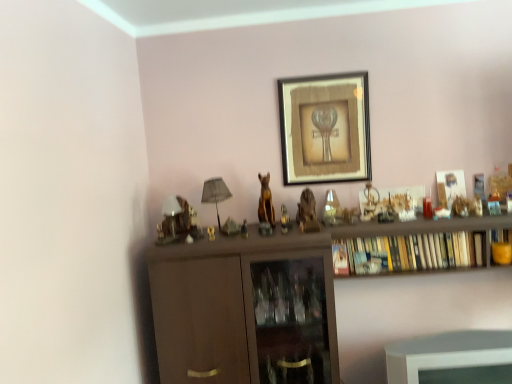
From the picture: What is the approximate width of metallic gold figurine at left, the fourth toy positioned from the right?

15.85 centimeters.

Measure the distance between point (285, 221) and camera.

6.90 feet.

How much space does metallic gold statue at center, placed as the third toy when sorted from left to right, occupy horizontally?

metallic gold statue at center, placed as the third toy when sorted from left to right, is 2.03 inches wide.

You are a GUI agent. You are given a task and a screenshot of the screen. Output one action in this format:
    pyautogui.click(x=<x>, y=<y>)
    Task: Click on the white glossy vanity at lower right
    This screenshot has height=384, width=512.
    Given the screenshot: What is the action you would take?
    pyautogui.click(x=452, y=358)

Where is `wooden statue at center, acting as the first animal starting from the right`? wooden statue at center, acting as the first animal starting from the right is located at coordinates (307, 213).

Which object is wider, matte brown statue at center, arranged as the second toy when viewed from the left, or white glossy vanity at lower right?

With larger width is white glossy vanity at lower right.

In the scene shown: Can you tell me how much matte brown statue at center, arranged as the third toy when viewed from the right, and white glossy vanity at lower right differ in facing direction?

The angular difference between matte brown statue at center, arranged as the third toy when viewed from the right, and white glossy vanity at lower right is 6.88 degrees.

Does point (244, 219) lie in front of point (396, 372)?

No, it is not.

Considering the relative positions of wooden framed artwork at center and wooden statue at center, which is the second animal in left-to-right order, in the image provided, is wooden framed artwork at center to the left of wooden statue at center, which is the second animal in left-to-right order, from the viewer's perspective?

Incorrect, wooden framed artwork at center is not on the left side of wooden statue at center, which is the second animal in left-to-right order.

Starting from the wooden framed artwork at center, which animal is the 2nd one in front? Please provide its 2D coordinates.

[(307, 213)]

Is the surface of wooden framed artwork at center in direct contact with wooden statue at center, which is the second animal in left-to-right order?

No, wooden framed artwork at center is not next to wooden statue at center, which is the second animal in left-to-right order.

In the scene shown: Considering the sizes of objects white glossy vanity at lower right and translucent glass vase at center, acting as the 4th toy starting from the left, in the image provided, who is taller, white glossy vanity at lower right or translucent glass vase at center, acting as the 4th toy starting from the left,?

With more height is white glossy vanity at lower right.

Which object is more forward, white glossy vanity at lower right or translucent glass vase at center, acting as the 4th toy starting from the left?

Positioned in front is white glossy vanity at lower right.

In terms of size, does white glossy vanity at lower right appear bigger or smaller than translucent glass vase at center, acting as the 4th toy starting from the left?

white glossy vanity at lower right is bigger than translucent glass vase at center, acting as the 4th toy starting from the left.

Does gold metallic statue at center, which ranks as the second animal in right-to-left order, come behind metallic gold statue at center, which is counted as the 2th toy, starting from the right?

Yes, gold metallic statue at center, which ranks as the second animal in right-to-left order, is behind metallic gold statue at center, which is counted as the 2th toy, starting from the right.

From a real-world perspective, who is located lower, gold metallic statue at center, which ranks as the second animal in right-to-left order, or metallic gold statue at center, placed as the third toy when sorted from left to right?

metallic gold statue at center, placed as the third toy when sorted from left to right, from a real-world perspective.

Is metallic gold statue at center, which is counted as the 2th toy, starting from the right, completely or partially inside gold metallic statue at center, which ranks as the second animal in right-to-left order?

No, gold metallic statue at center, which ranks as the second animal in right-to-left order, does not contain metallic gold statue at center, which is counted as the 2th toy, starting from the right.

Which toy is the 2nd one when counting from the back of the wooden bookshelf at center? Please provide its 2D coordinates.

[(177, 221)]

Between wooden bookshelf at center and metallic gold figurine at left, the 1th toy when ordered from left to right, which one has larger width?

Wider between the two is metallic gold figurine at left, the 1th toy when ordered from left to right.

Are wooden bookshelf at center and metallic gold figurine at left, the fourth toy positioned from the right, far apart?

wooden bookshelf at center is near metallic gold figurine at left, the fourth toy positioned from the right, not far away.

Which is closer to the camera, (355, 226) or (190, 229)?

Point (355, 226).

Considering the sizes of objects white glossy vanity at lower right and wooden framed artwork at center in the image provided, who is wider, white glossy vanity at lower right or wooden framed artwork at center?

With larger width is white glossy vanity at lower right.

From a real-world perspective, which is physically below, white glossy vanity at lower right or wooden framed artwork at center?

white glossy vanity at lower right, from a real-world perspective.

Who is smaller, white glossy vanity at lower right or wooden framed artwork at center?

Smaller between the two is wooden framed artwork at center.

What are the coordinates of `vanity located in front of the wooden framed artwork at center` in the screenshot? It's located at (452, 358).

Can you confirm if wooden statue at center, acting as the first animal starting from the right, is thinner than matte black lampshade at center?

In fact, wooden statue at center, acting as the first animal starting from the right, might be wider than matte black lampshade at center.

Is wooden statue at center, which is the second animal in left-to-right order, bigger or smaller than matte black lampshade at center?

Clearly, wooden statue at center, which is the second animal in left-to-right order, is smaller in size than matte black lampshade at center.

Who is taller, wooden statue at center, acting as the first animal starting from the right, or matte black lampshade at center?

matte black lampshade at center.

Would you say matte black lampshade at center is part of wooden statue at center, acting as the first animal starting from the right,'s contents?

That's incorrect, matte black lampshade at center is not inside wooden statue at center, acting as the first animal starting from the right.

The height and width of the screenshot is (384, 512). In order to click on vanity on the right of matte brown statue at center, arranged as the second toy when viewed from the left in this screenshot , I will do `click(452, 358)`.

Which animal is the 2nd one when counting from the front of the wooden framed artwork at center? Please provide its 2D coordinates.

[(307, 213)]

Looking at the image, which one is located closer to translucent glass vase at center, acting as the 4th toy starting from the left, gold metallic statue at center, which ranks as the second animal in right-to-left order, or matte black lampshade at center?

gold metallic statue at center, which ranks as the second animal in right-to-left order, lies closer to translucent glass vase at center, acting as the 4th toy starting from the left, than the other object.

When comparing their distances from matte brown statue at center, arranged as the third toy when viewed from the right, does wooden framed artwork at center or wooden statue at center, which is the second animal in left-to-right order, seem further?

Based on the image, wooden framed artwork at center appears to be further to matte brown statue at center, arranged as the third toy when viewed from the right.

Which object lies further to the anchor point metallic gold statue at center, placed as the third toy when sorted from left to right, wooden framed artwork at center or translucent glass vase at center, acting as the 4th toy starting from the left?

Based on the image, wooden framed artwork at center appears to be further to metallic gold statue at center, placed as the third toy when sorted from left to right.

Based on their spatial positions, is wooden statue at center, acting as the first animal starting from the right, or wooden framed artwork at center closer to translucent glass vase at center, acting as the 4th toy starting from the left?

Among the two, wooden statue at center, acting as the first animal starting from the right, is located nearer to translucent glass vase at center, acting as the 4th toy starting from the left.

Which object lies further to the anchor point wooden statue at center, which is the second animal in left-to-right order, gold metallic statue at center, the first animal in the left-to-right sequence, or translucent glass vase at center, acting as the 4th toy starting from the left?

gold metallic statue at center, the first animal in the left-to-right sequence.

Looking at the image, which one is located further to white glossy vanity at lower right, gold metallic statue at center, the first animal in the left-to-right sequence, or wooden framed artwork at center?

Based on the image, wooden framed artwork at center appears to be further to white glossy vanity at lower right.

Which object lies further to the anchor point wooden framed artwork at center, wooden statue at center, which is the second animal in left-to-right order, or white glossy vanity at lower right?

white glossy vanity at lower right.

Estimate the real-world distances between objects in this image. Which object is closer to metallic gold statue at center, placed as the third toy when sorted from left to right, gold metallic statue at center, which ranks as the second animal in right-to-left order, or metallic gold figurine at left, the fourth toy positioned from the right?

gold metallic statue at center, which ranks as the second animal in right-to-left order, lies closer to metallic gold statue at center, placed as the third toy when sorted from left to right, than the other object.

Where is `picture frame between matte black lampshade at center and wooden bookshelf at center`? The height and width of the screenshot is (384, 512). picture frame between matte black lampshade at center and wooden bookshelf at center is located at coordinates (325, 128).

I want to click on table lamp between wooden framed artwork at center and white glossy vanity at lower right in the vertical direction, so click(x=215, y=194).

Where is `animal that lies between wooden framed artwork at center and wooden statue at center, acting as the first animal starting from the right, from top to bottom`? The height and width of the screenshot is (384, 512). animal that lies between wooden framed artwork at center and wooden statue at center, acting as the first animal starting from the right, from top to bottom is located at coordinates (266, 202).

What are the coordinates of `picture frame between metallic gold figurine at left, the fourth toy positioned from the right, and translucent glass vase at center, the first toy when ordered from right to left` in the screenshot? It's located at (325, 128).